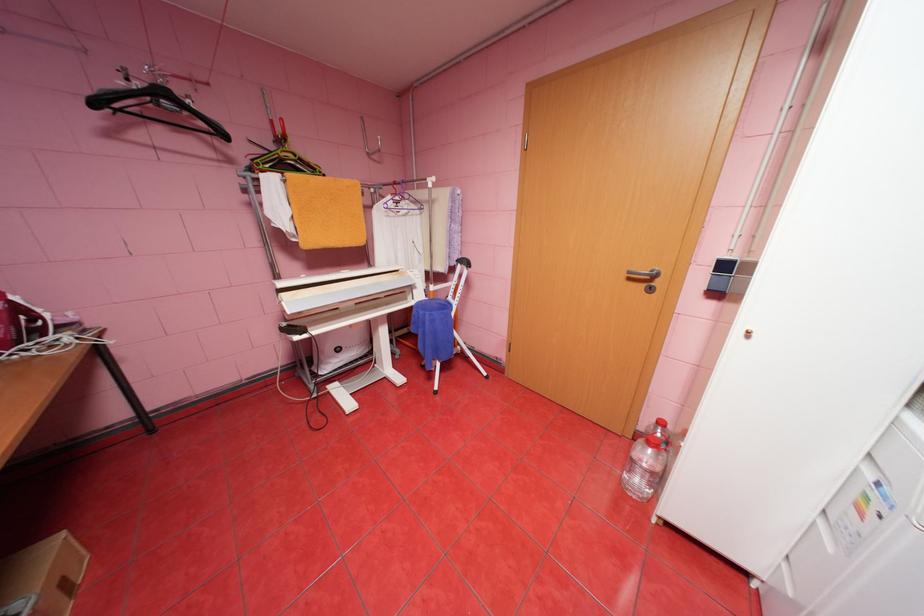
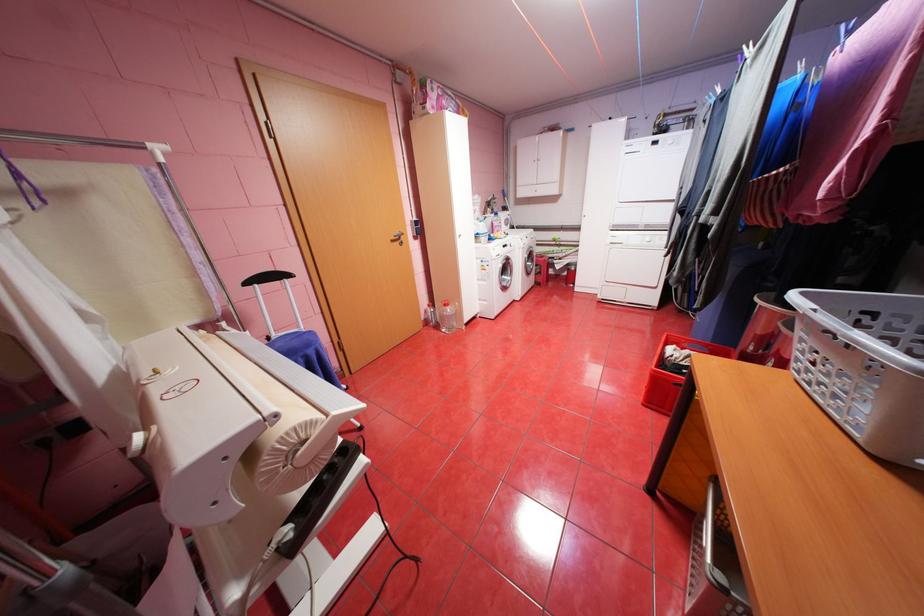
The point at (638,278) is marked in the first image. Where is the corresponding point in the second image?

(400, 241)